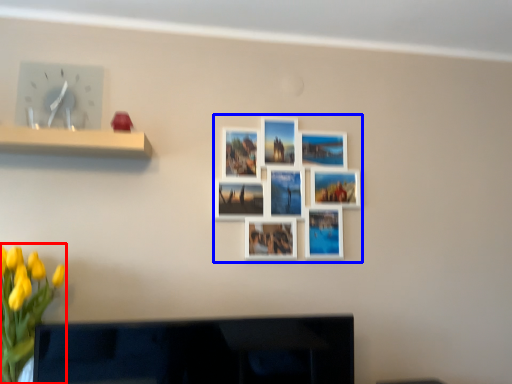
Question: Which of the following is the farthest to the observer, floral arrangement (highlighted by a red box) or decorative picture (highlighted by a blue box)?

Choices:
 (A) floral arrangement
 (B) decorative picture

Answer: (B)